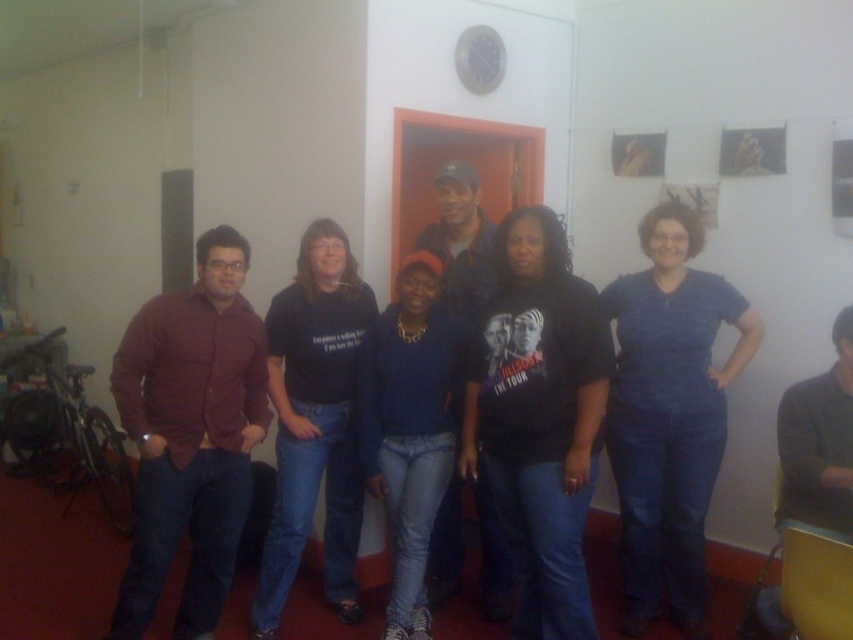
Question: Does blue denim jeans at center appear on the left side of denim jeans at center?

Choices:
 (A) no
 (B) yes

Answer: (A)

Question: Is matte burgundy shirt at left above blue denim jeans at center?

Choices:
 (A) yes
 (B) no

Answer: (B)

Question: Which of the following is the farthest from the observer?

Choices:
 (A) (654, 502)
 (B) (450, 417)

Answer: (A)

Question: Which object is positioned closest to the denim jeans at center?

Choices:
 (A) black cotton shirt at center
 (B) blue denim jeans at center
 (C) black matte shirt at center
 (D) matte burgundy shirt at left

Answer: (A)

Question: Which object is farther from the camera taking this photo?

Choices:
 (A) blue denim jeans at center
 (B) matte burgundy shirt at left

Answer: (A)

Question: Can you confirm if black cotton shirt at center is thinner than denim jeans at center?

Choices:
 (A) no
 (B) yes

Answer: (A)